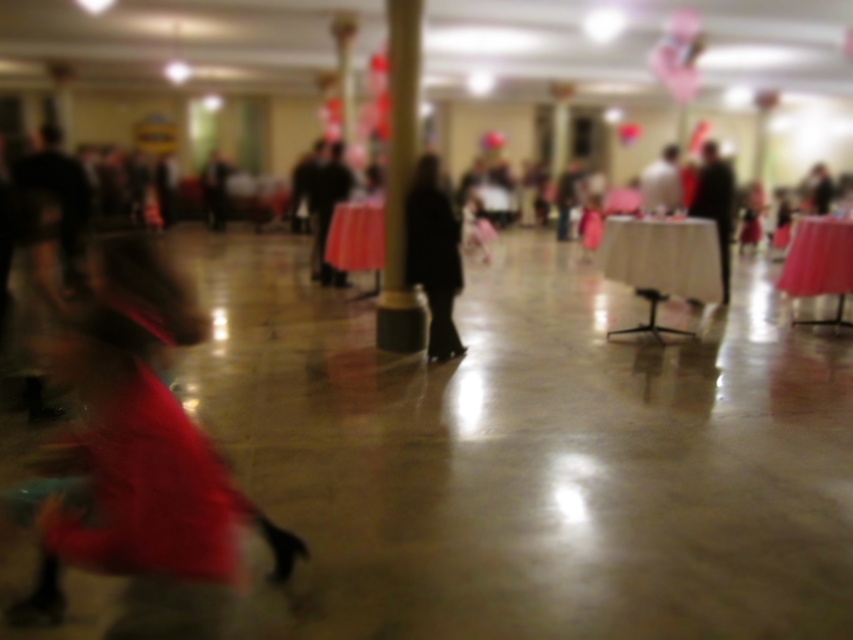
Between black matte coat at center and smooth pink table at right, which one has more height?

black matte coat at center is taller.

Does black matte coat at center appear on the left side of smooth pink table at right?

Indeed, black matte coat at center is positioned on the left side of smooth pink table at right.

Where is `black matte coat at center`? black matte coat at center is located at coordinates (433, 256).

Does white fabric table at center appear on the left side of smooth pink table at right?

Indeed, white fabric table at center is positioned on the left side of smooth pink table at right.

Does white fabric table at center appear under smooth pink table at right?

Yes, white fabric table at center is below smooth pink table at right.

Find the location of a particular element. Image resolution: width=853 pixels, height=640 pixels. white fabric table at center is located at coordinates (662, 260).

Who is higher up, white fabric table at center or black fabric coat at right?

black fabric coat at right is above.

Is white fabric table at center further to camera compared to black fabric coat at right?

That is False.

Is point (660, 291) positioned after point (711, 147)?

No.

Where is `white fabric table at center`? Image resolution: width=853 pixels, height=640 pixels. white fabric table at center is located at coordinates (662, 260).